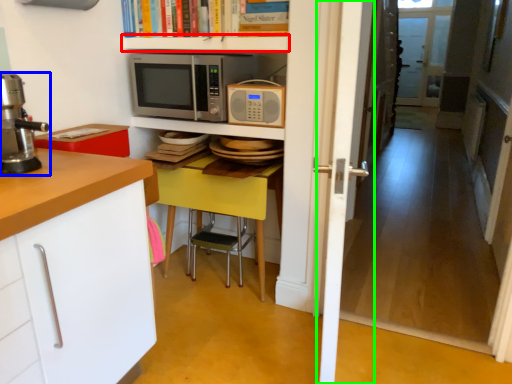
Question: Which object is positioned farthest from shelf (highlighted by a red box)? Select from home appliance (highlighted by a blue box) and door (highlighted by a green box).

Choices:
 (A) home appliance
 (B) door

Answer: (A)